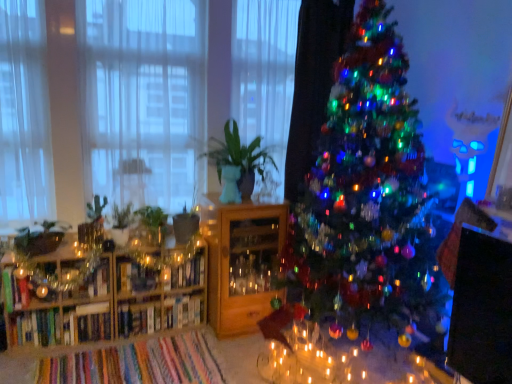
Measure the distance between point (173, 320) and camera.

Point (173, 320) is 2.97 meters from camera.

Image resolution: width=512 pixels, height=384 pixels. Describe the element at coordinates (242, 263) in the screenshot. I see `wooden cabinet at center, the 1th shelf viewed from the right` at that location.

Locate an element on the screen. This screenshot has height=384, width=512. green matte plant at left, the second plant from the left is located at coordinates (122, 216).

In order to face metallic glass shelf at left, which is the 1th shelf in left-to-right order, should I rotate leftwards or rightwards?

Rotate your view left by about 21.384°.

The image size is (512, 384). Identify the location of translucent glass table at center. (327, 361).

From the picture: From a real-world perspective, does hardcover book at center, which is the 1th book from right to left, sit lower than green matte plant at left, which is the 1th plant from left to right?

Yes, from a real-world perspective, hardcover book at center, which is the 1th book from right to left, is below green matte plant at left, which is the 1th plant from left to right.

Is hardcover book at center, placed as the second book when sorted from left to right, in front of green matte plant at left, which is the 1th plant from left to right?

No, it is behind green matte plant at left, which is the 1th plant from left to right.

How different are the orientations of hardcover book at center, placed as the second book when sorted from left to right, and green matte plant at left, which is the 1th plant from left to right, in degrees?

0.418 degrees.

From their relative heights in the image, would you say white sheer curtain at left, placed as the third curtain when sorted from right to left, is taller or shorter than iridescent glass christmas tree at center?

white sheer curtain at left, placed as the third curtain when sorted from right to left, is shorter than iridescent glass christmas tree at center.

Considering the relative positions of white sheer curtain at left, placed as the third curtain when sorted from right to left, and iridescent glass christmas tree at center in the image provided, is white sheer curtain at left, placed as the third curtain when sorted from right to left, in front of iridescent glass christmas tree at center?

No, it is not.

In the scene shown: Could you tell me if white sheer curtain at left, placed as the third curtain when sorted from right to left, is turned towards iridescent glass christmas tree at center?

No, white sheer curtain at left, placed as the third curtain when sorted from right to left, is not turned towards iridescent glass christmas tree at center.

From the image's perspective, is white sheer curtain at left, positioned as the 1th curtain in left-to-right order, beneath iridescent glass christmas tree at center?

No, from the image's perspective, white sheer curtain at left, positioned as the 1th curtain in left-to-right order, is not below iridescent glass christmas tree at center.

From the image's perspective, would you say white sheer curtain at left, positioned as the 1th curtain in left-to-right order, is shown under white sheer curtain at upper center, acting as the third curtain starting from the left?

Yes, from the image's perspective, white sheer curtain at left, positioned as the 1th curtain in left-to-right order, is below white sheer curtain at upper center, acting as the third curtain starting from the left.

Which object is closer to the camera taking this photo, white sheer curtain at left, positioned as the 1th curtain in left-to-right order, or white sheer curtain at upper center, which ranks as the first curtain in right-to-left order?

white sheer curtain at left, positioned as the 1th curtain in left-to-right order, is closer to the camera.

Would you say white sheer curtain at left, positioned as the 1th curtain in left-to-right order, contains white sheer curtain at upper center, acting as the third curtain starting from the left?

No, white sheer curtain at upper center, acting as the third curtain starting from the left, is not a part of white sheer curtain at left, positioned as the 1th curtain in left-to-right order.

How many degrees apart are the facing directions of white sheer curtain at left, placed as the third curtain when sorted from right to left, and white sheer curtain at upper center, acting as the third curtain starting from the left?

The facing directions of white sheer curtain at left, placed as the third curtain when sorted from right to left, and white sheer curtain at upper center, acting as the third curtain starting from the left, are 0.00205 degrees apart.

This screenshot has width=512, height=384. Identify the location of shelf that is the 2nd one when counting downward from the green matte plant at left, which is the 1th plant from left to right (from the image's perspective). (86, 278).

Which object is thinner, green matte plant at left, which is the 1th plant from left to right, or metallic glass shelf at left, acting as the 2th shelf starting from the right?

Thinner between the two is metallic glass shelf at left, acting as the 2th shelf starting from the right.

Is point (20, 251) closer to viewer compared to point (76, 295)?

Yes, point (20, 251) is in front of point (76, 295).

How different are the orientations of green matte plant at left, which is counted as the 2th plant, starting from the right, and metallic glass shelf at left, which is the 1th shelf in left-to-right order, in degrees?

3.77 degrees separate the facing orientations of green matte plant at left, which is counted as the 2th plant, starting from the right, and metallic glass shelf at left, which is the 1th shelf in left-to-right order.

From the picture: Is metallic glass shelf at left, acting as the 2th shelf starting from the right, in front of or behind translucent glass table at center in the image?

metallic glass shelf at left, acting as the 2th shelf starting from the right, is positioned farther from the viewer than translucent glass table at center.

Which of these two, metallic glass shelf at left, which is the 1th shelf in left-to-right order, or translucent glass table at center, is bigger?

Bigger between the two is translucent glass table at center.

Considering the sizes of objects metallic glass shelf at left, which is the 1th shelf in left-to-right order, and translucent glass table at center in the image provided, who is taller, metallic glass shelf at left, which is the 1th shelf in left-to-right order, or translucent glass table at center?

Standing taller between the two is translucent glass table at center.

Which point is more distant from viewer, [73,275] or [311,330]?

The point [311,330] is behind.

Is white sheer curtain at left, the 2th curtain from the right, with metallic glass shelf at left, which is the 1th shelf in left-to-right order?

No, white sheer curtain at left, the 2th curtain from the right, is not touching metallic glass shelf at left, which is the 1th shelf in left-to-right order.

Considering the relative sizes of white sheer curtain at left, the 2th curtain from the right, and metallic glass shelf at left, acting as the 2th shelf starting from the right, in the image provided, is white sheer curtain at left, the 2th curtain from the right, wider than metallic glass shelf at left, acting as the 2th shelf starting from the right,?

Yes, white sheer curtain at left, the 2th curtain from the right, is wider than metallic glass shelf at left, acting as the 2th shelf starting from the right.

How distant is white sheer curtain at left, the 2th curtain from the right, from metallic glass shelf at left, acting as the 2th shelf starting from the right?

A distance of 39.06 inches exists between white sheer curtain at left, the 2th curtain from the right, and metallic glass shelf at left, acting as the 2th shelf starting from the right.

Considering the relative sizes of white sheer curtain at left, placed as the second curtain when sorted from left to right, and metallic glass shelf at left, which is the 1th shelf in left-to-right order, in the image provided, is white sheer curtain at left, placed as the second curtain when sorted from left to right, shorter than metallic glass shelf at left, which is the 1th shelf in left-to-right order,?

No.

Is green matte plant at center positioned with its back to iridescent glass christmas tree at center?

No, green matte plant at center is not facing away from iridescent glass christmas tree at center.

Considering the sizes of objects green matte plant at center and iridescent glass christmas tree at center in the image provided, who is shorter, green matte plant at center or iridescent glass christmas tree at center?

With less height is green matte plant at center.

The width and height of the screenshot is (512, 384). I want to click on christmas tree below the green matte plant at center (from a real-world perspective), so click(x=366, y=194).

Considering the relative sizes of green matte plant at center and iridescent glass christmas tree at center in the image provided, is green matte plant at center smaller than iridescent glass christmas tree at center?

Indeed, green matte plant at center has a smaller size compared to iridescent glass christmas tree at center.

Where is `the 2nd plant counting from the left side of the hardcover book at center, which is the 1th book from right to left`? The image size is (512, 384). the 2nd plant counting from the left side of the hardcover book at center, which is the 1th book from right to left is located at coordinates (40, 238).

Find the location of a particular element. The width and height of the screenshot is (512, 384). the 1st curtain above the iridescent glass christmas tree at center (from the image's perspective) is located at coordinates (24, 117).

Estimate the real-world distances between objects in this image. Which object is closer to green matte plant at left, which is the 1th plant from left to right, white sheer curtain at upper center, acting as the third curtain starting from the left, or wooden cabinet at center, the 1th shelf viewed from the right?

The object closer to green matte plant at left, which is the 1th plant from left to right, is wooden cabinet at center, the 1th shelf viewed from the right.

In the scene shown: Which object lies nearer to the anchor point hardcover book at center, which is the 1th book from right to left, green matte plant at left, which is counted as the 2th plant, starting from the right, or wooden cabinet at center, which ranks as the second shelf in left-to-right order?

wooden cabinet at center, which ranks as the second shelf in left-to-right order, is closer to hardcover book at center, which is the 1th book from right to left.

Estimate the real-world distances between objects in this image. Which object is further from translucent glass table at center, white sheer curtain at left, positioned as the 1th curtain in left-to-right order, or hardcover book at center, placed as the second book when sorted from left to right?

The object further to translucent glass table at center is white sheer curtain at left, positioned as the 1th curtain in left-to-right order.

When comparing their distances from green matte plant at left, the second plant from the left, does green matte plant at left, which is the 1th plant from left to right, or hardcover book at center, placed as the second book when sorted from left to right, seem further?

Among the two, hardcover book at center, placed as the second book when sorted from left to right, is located further to green matte plant at left, the second plant from the left.

Looking at the image, which one is located further to wooden cabinet at center, which ranks as the second shelf in left-to-right order, hardcover book at center, which is the 2th book from right to left, or white sheer curtain at upper center, which ranks as the first curtain in right-to-left order?

white sheer curtain at upper center, which ranks as the first curtain in right-to-left order, lies further to wooden cabinet at center, which ranks as the second shelf in left-to-right order, than the other object.

Estimate the real-world distances between objects in this image. Which object is further from wooden bookshelf at left, green matte plant at left, the first plant positioned from the right, or translucent glass table at center?

translucent glass table at center.

Looking at the image, which one is located further to white sheer curtain at left, placed as the third curtain when sorted from right to left, white sheer curtain at upper center, which ranks as the first curtain in right-to-left order, or green matte plant at left, which is the 1th plant from left to right?

white sheer curtain at upper center, which ranks as the first curtain in right-to-left order, is further to white sheer curtain at left, placed as the third curtain when sorted from right to left.

From the picture: Estimate the real-world distances between objects in this image. Which object is closer to iridescent glass christmas tree at center, green matte plant at left, which is counted as the 2th plant, starting from the right, or white sheer curtain at upper center, which ranks as the first curtain in right-to-left order?

white sheer curtain at upper center, which ranks as the first curtain in right-to-left order, lies closer to iridescent glass christmas tree at center than the other object.

What are the coordinates of `houseplant between white sheer curtain at upper center, acting as the third curtain starting from the left, and wooden cabinet at center, the 1th shelf viewed from the right, vertically` in the screenshot? It's located at (240, 159).

What are the coordinates of `bookcase between white sheer curtain at left, placed as the third curtain when sorted from right to left, and hardcover book at center, positioned as the 1th book in left-to-right order, vertically` in the screenshot? It's located at (112, 303).

Find the location of `bookcase located between white sheer curtain at left, positioned as the 1th curtain in left-to-right order, and green matte plant at center in the left-right direction`. bookcase located between white sheer curtain at left, positioned as the 1th curtain in left-to-right order, and green matte plant at center in the left-right direction is located at coordinates (112, 303).

Where is `plant between wooden bookshelf at left and green matte plant at center`? The height and width of the screenshot is (384, 512). plant between wooden bookshelf at left and green matte plant at center is located at coordinates (122, 216).